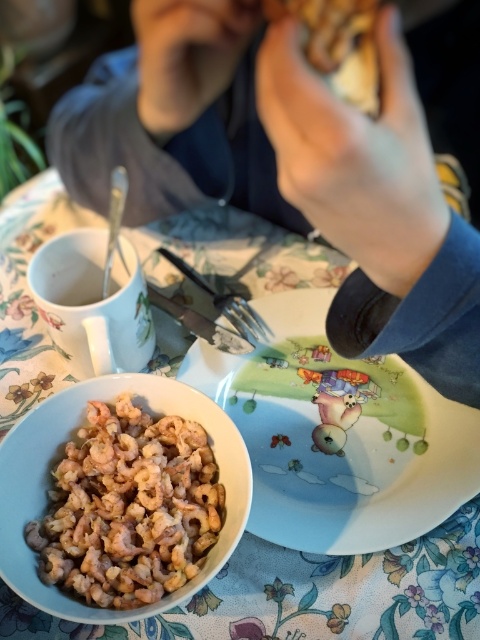
Does floral fabric tablecloth at lower center appear under pinkish matte shrimp at center?

Actually, floral fabric tablecloth at lower center is above pinkish matte shrimp at center.

Does floral fabric tablecloth at lower center have a lesser height compared to pinkish matte shrimp at center?

Incorrect, floral fabric tablecloth at lower center's height does not fall short of pinkish matte shrimp at center's.

Measure the distance between point (294, 237) and camera.

Point (294, 237) and camera are 25.05 inches apart from each other.

Find the location of `floral fabric tablecloth at lower center`. floral fabric tablecloth at lower center is located at coordinates (308, 595).

Can you confirm if smooth skin hand at upper right is bigger than silver metallic fork at center?

Correct, smooth skin hand at upper right is larger in size than silver metallic fork at center.

Who is more forward, (215, 44) or (220, 292)?

Point (215, 44) is in front.

Between point (460, 317) and point (260, 333), which one is positioned in front?

Point (460, 317) is in front.

The width and height of the screenshot is (480, 640). Identify the location of smooth skin hand at upper right. (286, 168).

Between smooth skin hand at upper right and floral fabric tablecloth at lower center, which one has more height?

Standing taller between the two is floral fabric tablecloth at lower center.

Which is below, smooth skin hand at upper right or floral fabric tablecloth at lower center?

floral fabric tablecloth at lower center is lower down.

Locate an element on the screen. smooth skin hand at upper right is located at coordinates [286, 168].

Identify the location of smooth skin hand at upper right. The width and height of the screenshot is (480, 640). (286, 168).